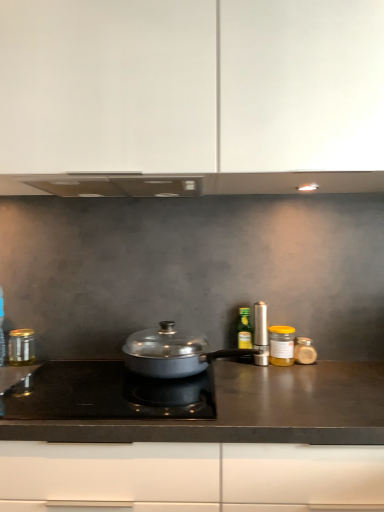
In order to click on spots to the right of clear glass jar at left, marked as the 1th kitchen appliance in a left-to-right arrangement in this screenshot , I will do `click(63, 364)`.